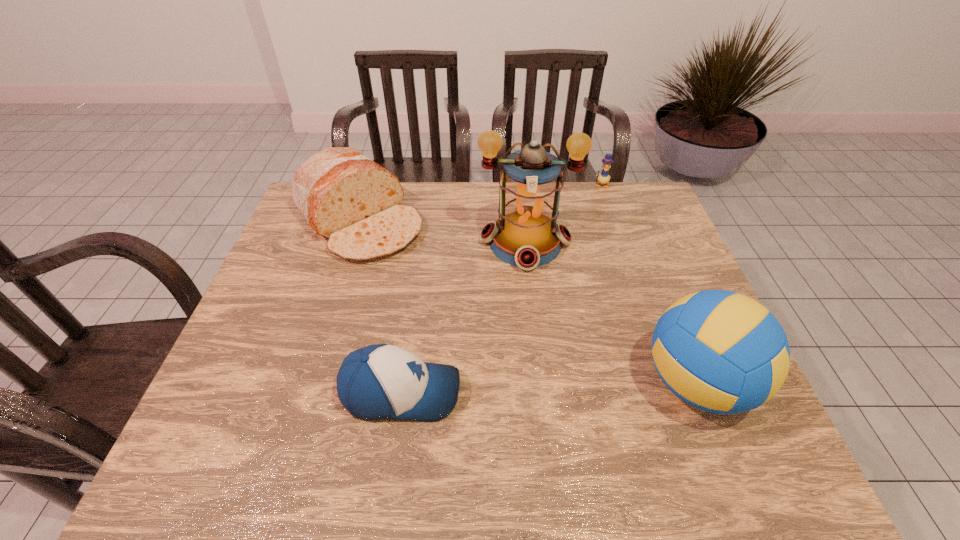
Where is `vacant point located 0.060m on the front-facing side of the third object from right to left`? The image size is (960, 540). vacant point located 0.060m on the front-facing side of the third object from right to left is located at coordinates (526, 290).

The height and width of the screenshot is (540, 960). Find the location of `free space located at the sliced end of the third shortest object`. free space located at the sliced end of the third shortest object is located at coordinates (440, 298).

The width and height of the screenshot is (960, 540). I want to click on vacant space situated at the sliced end of the third shortest object, so click(x=458, y=315).

You are a GUI agent. You are given a task and a screenshot of the screen. Output one action in this format:
    pyautogui.click(x=<x>, y=<y>)
    Task: Click on the vacant region located 0.310m at the sliced end of the third shortest object
    
    Given the screenshot: What is the action you would take?
    pyautogui.click(x=461, y=318)

Image resolution: width=960 pixels, height=540 pixels. Identify the location of free space located 0.080m on the face of the duckling, where the monocle is placed. (600, 201).

Locate an element on the screen. This screenshot has height=540, width=960. free space located 0.400m on the face of the duckling, where the monocle is placed is located at coordinates (597, 266).

Locate an element on the screen. The image size is (960, 540). vacant space located on the face of the duckling, where the monocle is placed is located at coordinates (599, 235).

The height and width of the screenshot is (540, 960). I want to click on lantern located at the far edge, so click(526, 235).

Where is `bread present at the far edge`? The image size is (960, 540). bread present at the far edge is located at coordinates (346, 197).

This screenshot has height=540, width=960. Find the location of `duckling at the far edge`. duckling at the far edge is located at coordinates (603, 178).